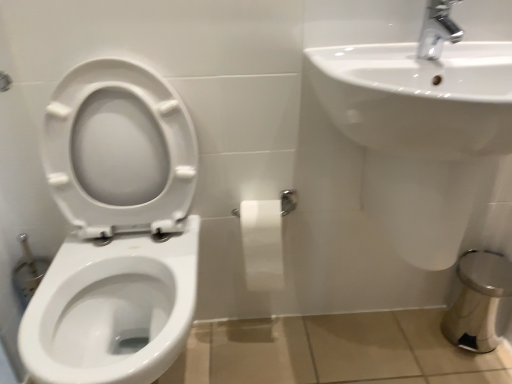
Find the location of a particular element. The image size is (512, 384). vacant region to the left of chrome metallic faucet at upper right is located at coordinates (353, 55).